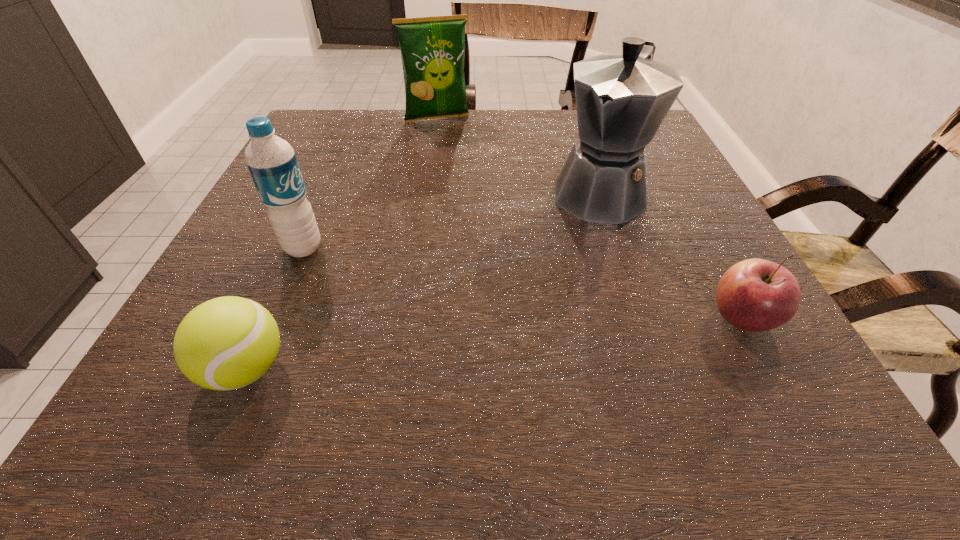
Where is `vacant position located on the label of the water bottle`? vacant position located on the label of the water bottle is located at coordinates (400, 283).

Where is `vacant space situated 0.230m on the label of the water bottle`? The image size is (960, 540). vacant space situated 0.230m on the label of the water bottle is located at coordinates (432, 294).

In order to click on free space located 0.210m at the spout of the second farthest object in this screenshot , I will do `click(540, 293)`.

Image resolution: width=960 pixels, height=540 pixels. In order to click on blank area located at the spout of the second farthest object in this screenshot , I will do `click(513, 336)`.

Where is `free region located 0.080m at the spout of the second farthest object`? free region located 0.080m at the spout of the second farthest object is located at coordinates (569, 247).

At what (x,y) coordinates should I click in order to perform the action: click on free location located 0.120m on the front-facing side of the farthest object. Please return your answer as a coordinate pair (x, y). The width and height of the screenshot is (960, 540). Looking at the image, I should click on (454, 148).

Identify the location of vacant space located 0.180m on the front-facing side of the farthest object. tap(459, 161).

Where is `free spot located 0.230m on the front-facing side of the farthest object`? free spot located 0.230m on the front-facing side of the farthest object is located at coordinates (465, 173).

The height and width of the screenshot is (540, 960). What are the coordinates of `object present at the far edge` in the screenshot? It's located at (432, 49).

Locate an element on the screen. tennis ball that is at the near edge is located at coordinates (225, 343).